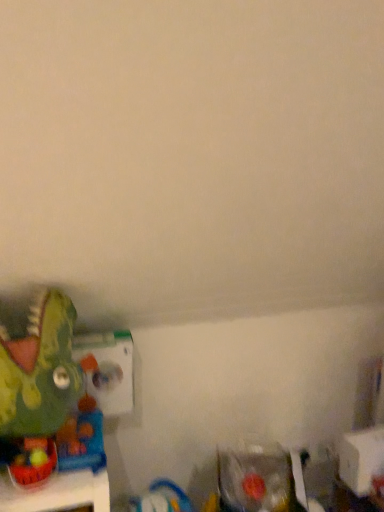
Question: Is clear plastic toy at lower right, marked as the 1th toy in a right-to-left arrangement, behind rubberized green dinosaur at lower left, the first toy in the left-to-right sequence?

Choices:
 (A) no
 (B) yes

Answer: (B)

Question: Does clear plastic toy at lower right, which ranks as the 3th toy in left-to-right order, appear on the left side of rubberized green dinosaur at lower left, the first toy in the left-to-right sequence?

Choices:
 (A) yes
 (B) no

Answer: (B)

Question: Is clear plastic toy at lower right, the third toy in the top-to-bottom sequence, positioned far away from rubberized green dinosaur at lower left, which is the 3th toy in right-to-left order?

Choices:
 (A) no
 (B) yes

Answer: (A)

Question: Does clear plastic toy at lower right, the third toy in the top-to-bottom sequence, appear on the right side of rubberized green dinosaur at lower left, which ranks as the 2th toy in bottom-to-top order?

Choices:
 (A) yes
 (B) no

Answer: (A)

Question: Can you see clear plastic toy at lower right, marked as the 1th toy in a right-to-left arrangement, touching rubberized green dinosaur at lower left, which is the 2th toy in top-to-bottom order?

Choices:
 (A) yes
 (B) no

Answer: (B)

Question: Does clear plastic toy at lower right, marked as the 1th toy in a right-to-left arrangement, come in front of rubberized green dinosaur at lower left, which is the 3th toy in right-to-left order?

Choices:
 (A) no
 (B) yes

Answer: (A)

Question: Does clear plastic toy at lower right, which is the first toy in bottom-to-top order, have a greater width compared to green matte dinosaur at left, which appears as the 1th toy when viewed from the top?

Choices:
 (A) yes
 (B) no

Answer: (B)

Question: Is clear plastic toy at lower right, marked as the 1th toy in a right-to-left arrangement, oriented towards green matte dinosaur at left, the 2th toy viewed from the left?

Choices:
 (A) no
 (B) yes

Answer: (A)

Question: From the image's perspective, is clear plastic toy at lower right, which ranks as the 3th toy in left-to-right order, beneath green matte dinosaur at left, which appears as the 1th toy when viewed from the top?

Choices:
 (A) no
 (B) yes

Answer: (B)

Question: From a real-world perspective, is clear plastic toy at lower right, the third toy in the top-to-bottom sequence, on green matte dinosaur at left, the 2th toy viewed from the left?

Choices:
 (A) yes
 (B) no

Answer: (B)

Question: Considering the relative sizes of clear plastic toy at lower right, the third toy in the top-to-bottom sequence, and green matte dinosaur at left, the 2th toy viewed from the left, in the image provided, is clear plastic toy at lower right, the third toy in the top-to-bottom sequence, shorter than green matte dinosaur at left, the 2th toy viewed from the left,?

Choices:
 (A) no
 (B) yes

Answer: (B)

Question: Is the position of clear plastic toy at lower right, marked as the 1th toy in a right-to-left arrangement, more distant than that of green matte dinosaur at left, which appears as the 1th toy when viewed from the top?

Choices:
 (A) yes
 (B) no

Answer: (A)

Question: From the image's perspective, is green matte dinosaur at left, positioned as the 2th toy in right-to-left order, on top of clear plastic toy at lower right, the third toy in the top-to-bottom sequence?

Choices:
 (A) no
 (B) yes

Answer: (B)